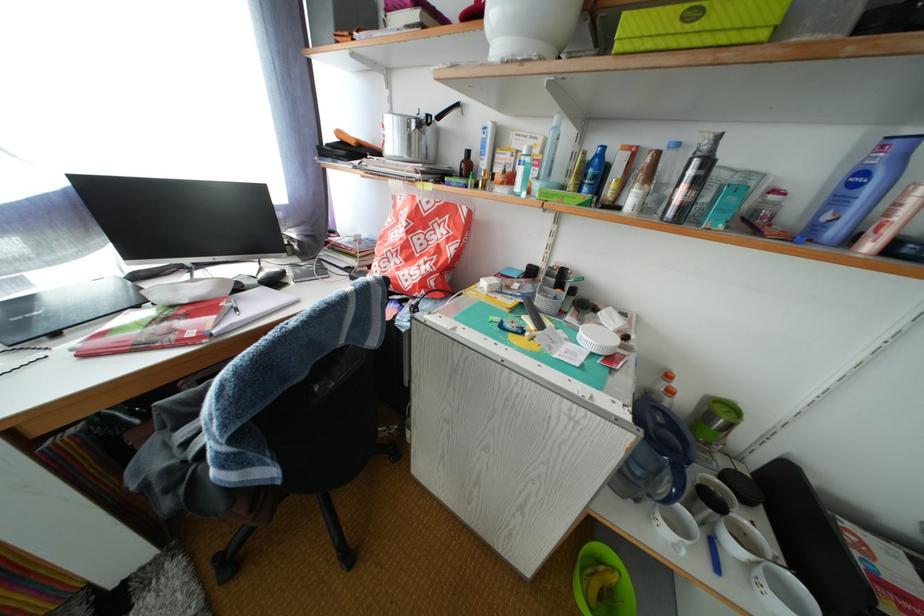
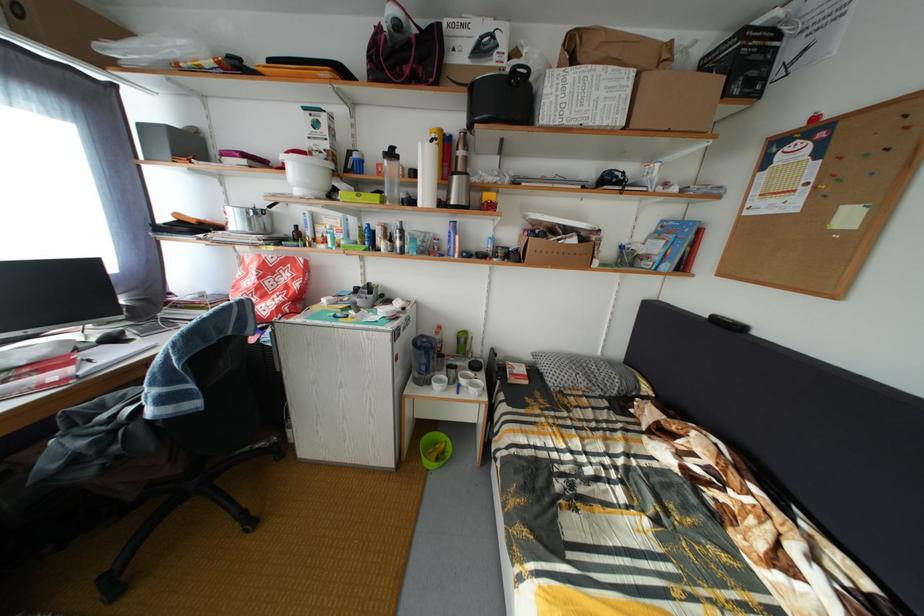
Find the pixel in the second image that matches pixel 195 308 in the first image.

(31, 370)